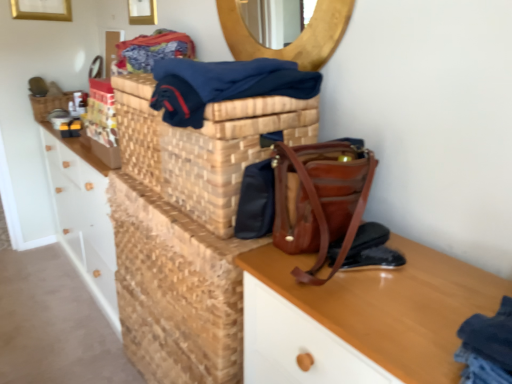
At what (x,y) coordinates should I click in order to perform the action: click on free spot to the right of black leather shoe at lower right, the 2th shoe viewed from the top. Please return your answer as a coordinate pair (x, y). Looking at the image, I should click on (438, 273).